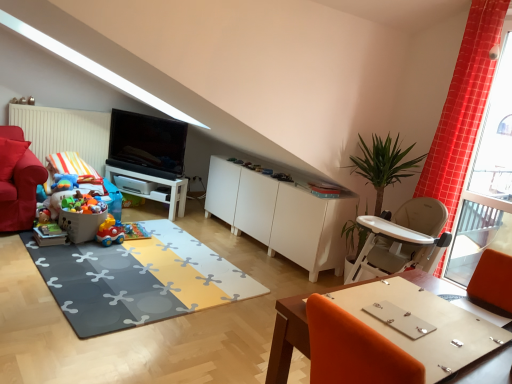
Question: Would you say white matte cabinet at center is to the left or to the right of matte plastic toy at lower left, positioned as the first toy in bottom-to-top order, in the picture?

Choices:
 (A) left
 (B) right

Answer: (B)

Question: Do you think white matte cabinet at center is within matte plastic toy at lower left, acting as the fourth toy starting from the top, or outside of it?

Choices:
 (A) outside
 (B) inside

Answer: (A)

Question: Estimate the real-world distances between objects in this image. Which object is farther from the plastic matte car at center, which is counted as the third toy, starting from the top?

Choices:
 (A) plastic toy car at lower left, the second toy positioned from the top
 (B) velvet red armchair at left
 (C) soft rubber mat at center
 (D) white glossy table at center, arranged as the first table when viewed from the left
 (E) white matte cabinet at center

Answer: (E)

Question: Which object is the closest to the white glossy table at center, the 2th table from the bottom?

Choices:
 (A) white matte cabinet at center
 (B) wooden table at lower right, which is the 1th table from front to back
 (C) red checkered curtain at right
 (D) soft rubber mat at center
 (E) blue plush toy at left, marked as the fourth toy in a bottom-to-top arrangement

Answer: (E)